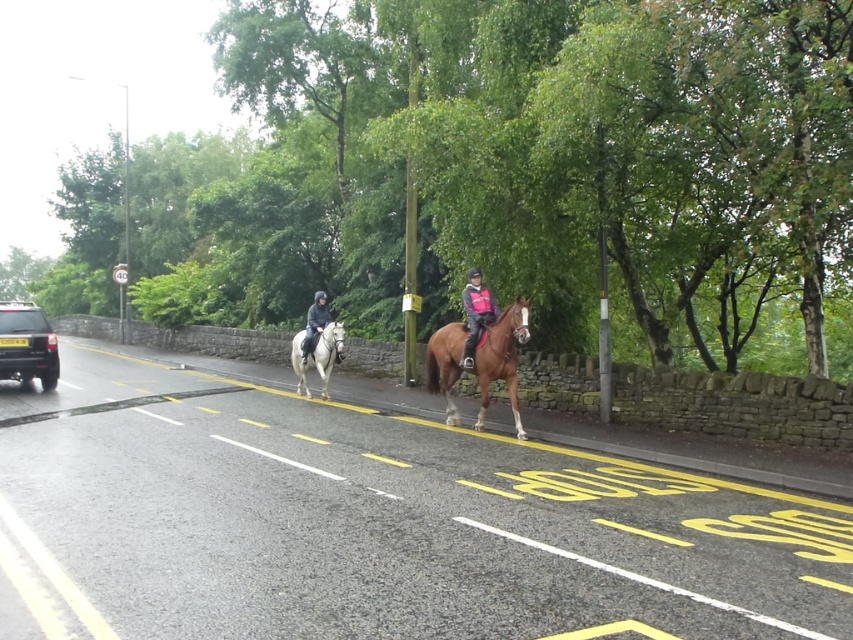
Question: Is pink fabric jacket at center wider than dark blue fabric jacket at center?

Choices:
 (A) no
 (B) yes

Answer: (B)

Question: Does white glossy horse at center appear on the right side of dark blue fabric jacket at center?

Choices:
 (A) no
 (B) yes

Answer: (B)

Question: Which object appears farthest from the camera in this image?

Choices:
 (A) black matte suv at left
 (B) pink fabric jacket at center

Answer: (A)

Question: Estimate the real-world distances between objects in this image. Which object is farther from the brown glossy horse at center?

Choices:
 (A) black matte suv at left
 (B) pink fabric jacket at center
 (C) dark blue fabric jacket at center
 (D) white glossy horse at center

Answer: (A)

Question: Is brown glossy horse at center bigger than pink fabric jacket at center?

Choices:
 (A) yes
 (B) no

Answer: (A)

Question: Which object appears closest to the camera in this image?

Choices:
 (A) pink fabric jacket at center
 (B) dark blue fabric jacket at center

Answer: (A)